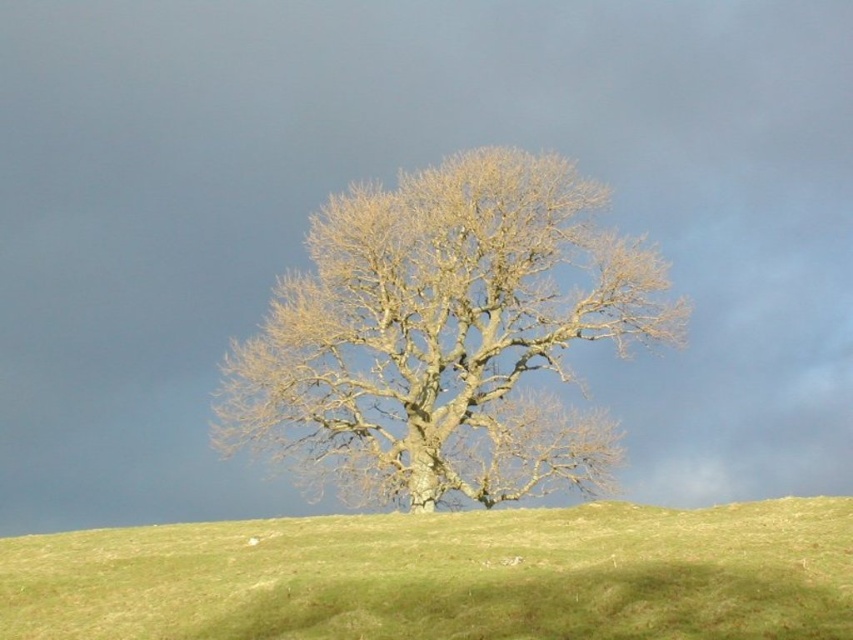
What do you see at coordinates (444, 337) in the screenshot? I see `bare wood tree at center` at bounding box center [444, 337].

Is point (410, 440) positioned after point (374, 572)?

Yes, point (410, 440) is farther from viewer.

Is point (323, 237) positioned in front of point (105, 573)?

No, it is behind (105, 573).

The image size is (853, 640). In order to click on bare wood tree at center in this screenshot , I will do `click(444, 337)`.